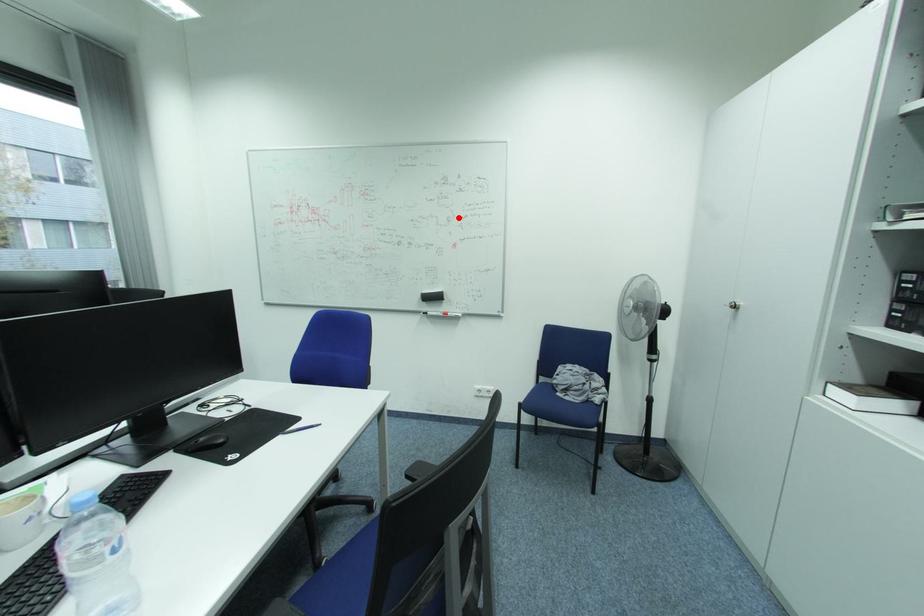
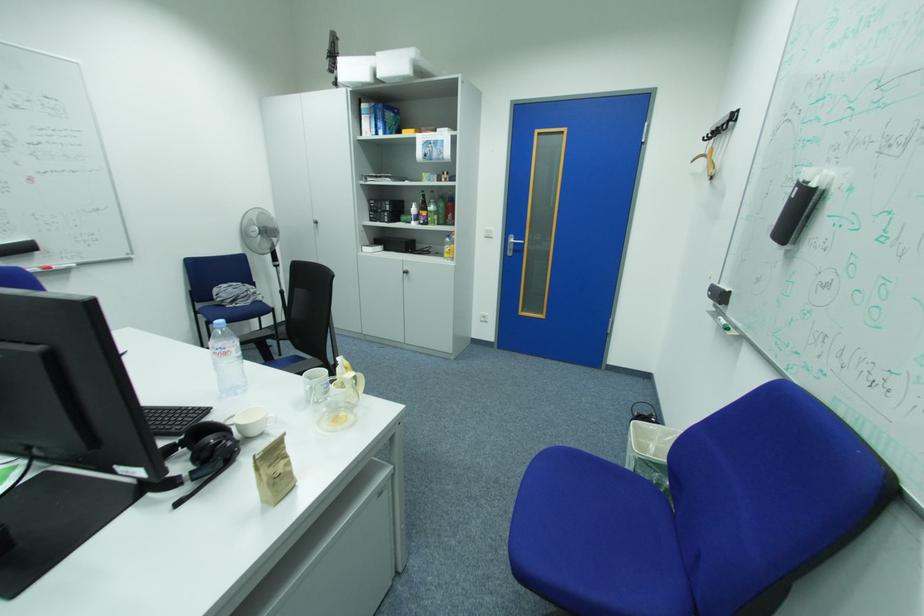
Where in the second image is the point corresponding to the highlighted location from the first image?

(14, 140)